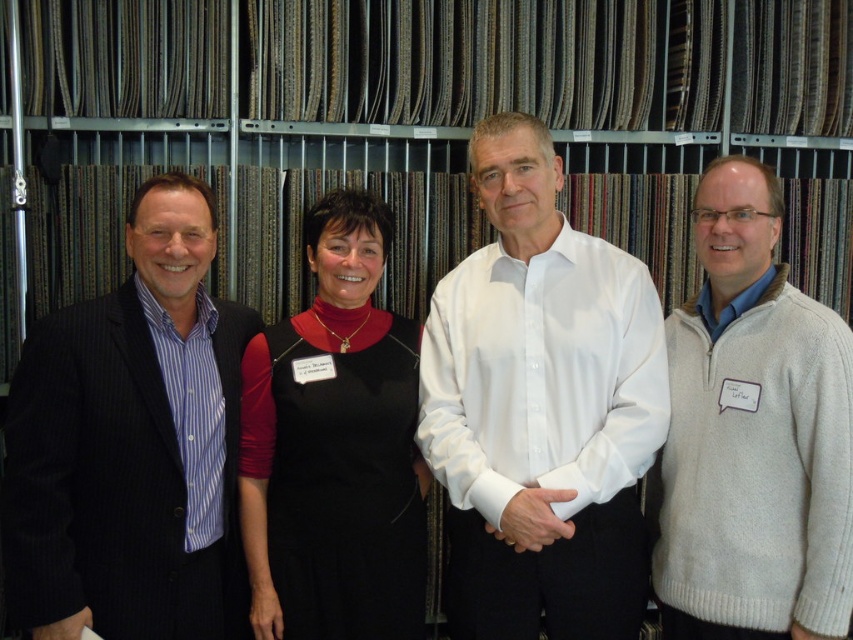
Who is more forward, (651, 410) or (772, 216)?

Point (772, 216) is in front.

In order to click on white smooth shirt at center in this screenshot , I will do `click(540, 408)`.

Who is shorter, striped cotton shirt at left or black dress at center?

With less height is black dress at center.

Can you confirm if striped cotton shirt at left is smaller than black dress at center?

Incorrect, striped cotton shirt at left is not smaller in size than black dress at center.

Where is `striped cotton shirt at left`? The height and width of the screenshot is (640, 853). striped cotton shirt at left is located at coordinates (131, 444).

Between white smooth shirt at center and striped cotton shirt at left, which one appears on the left side from the viewer's perspective?

striped cotton shirt at left

In the scene shown: Who is higher up, white smooth shirt at center or striped cotton shirt at left?

Positioned higher is white smooth shirt at center.

Between point (427, 445) and point (219, 516), which one is positioned in front?

Point (219, 516) is more forward.

At what (x,y) coordinates should I click in order to perform the action: click on white smooth shirt at center. Please return your answer as a coordinate pair (x, y). The width and height of the screenshot is (853, 640). Looking at the image, I should click on (540, 408).